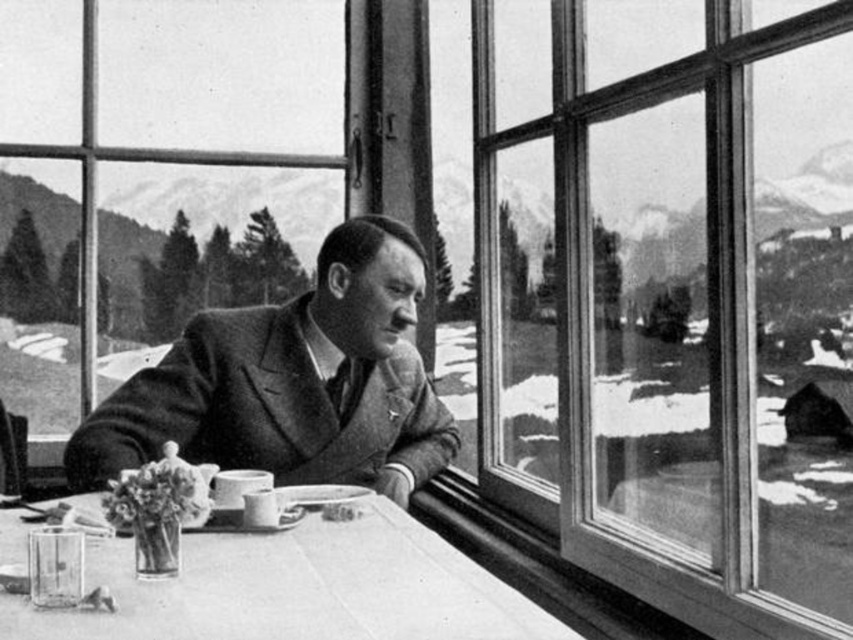
Between point (451, 449) and point (357, 573), which one is positioned behind?

The point (451, 449) is behind.

Locate an element on the screen. Image resolution: width=853 pixels, height=640 pixels. smooth woolen suit at center is located at coordinates (292, 381).